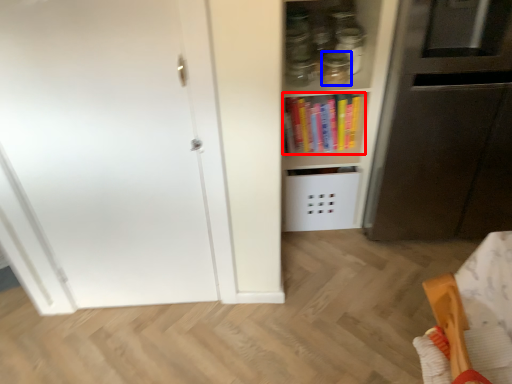
Question: Which of the following is the closest to the observer, book (highlighted by a red box) or glass jar (highlighted by a blue box)?

Choices:
 (A) book
 (B) glass jar

Answer: (B)